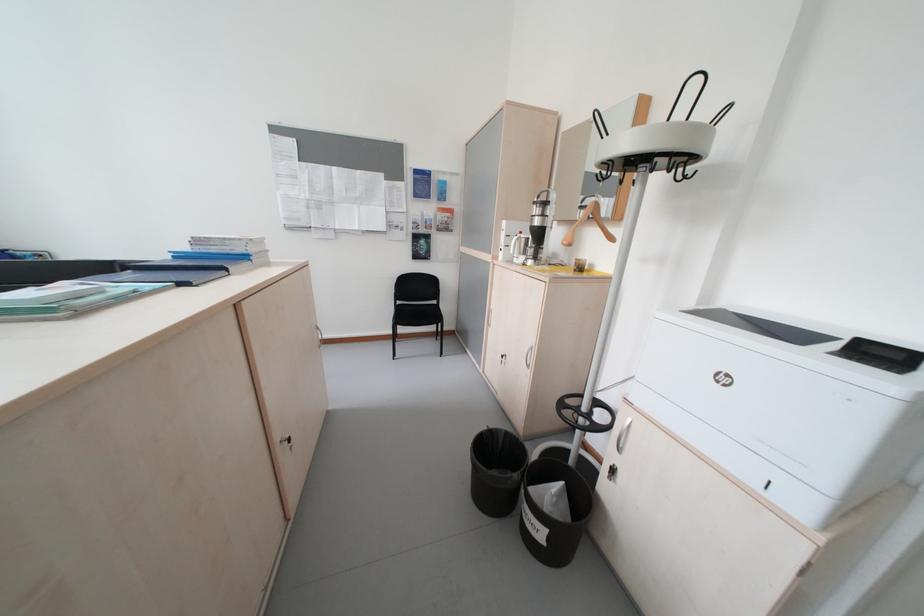
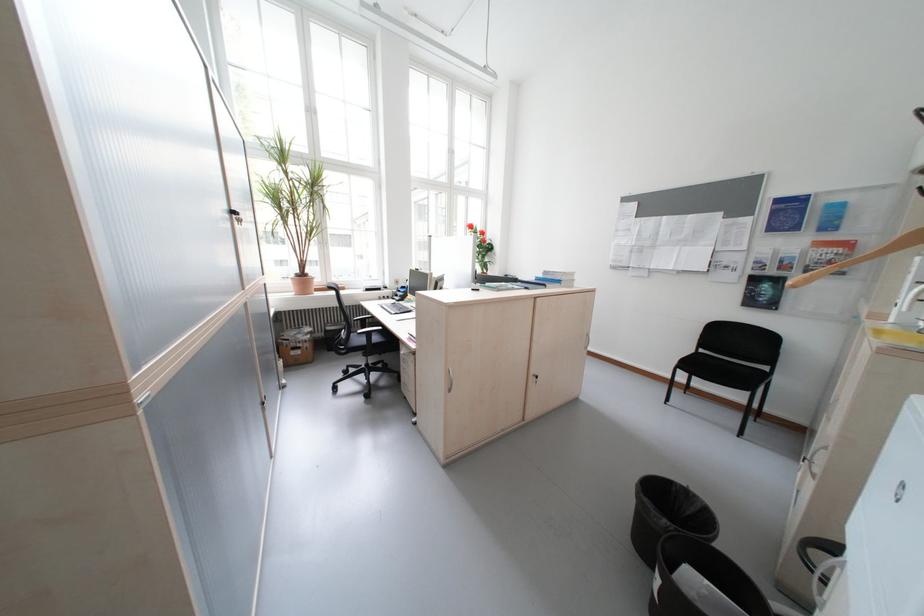
Where in the second image is the point corresponding to [438,238] from the first image?

(788, 282)